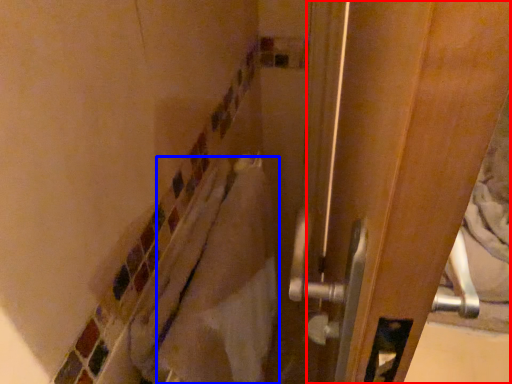
Question: Which object is closer to the camera taking this photo, screen door (highlighted by a red box) or material (highlighted by a blue box)?

Choices:
 (A) screen door
 (B) material

Answer: (A)